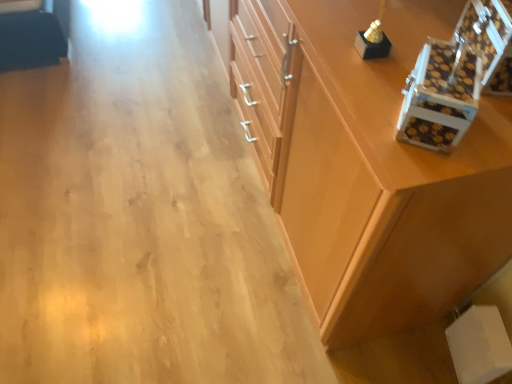
Question: Based on their positions, is white textured box at upper right, the second box in the right-to-left sequence, located to the left or right of brown checkered box at upper right, which appears as the first box when viewed from the right?

Choices:
 (A) left
 (B) right

Answer: (A)

Question: Is white textured box at upper right, marked as the 1th box in a left-to-right arrangement, situated inside brown checkered box at upper right, which is the second box from left to right, or outside?

Choices:
 (A) outside
 (B) inside

Answer: (A)

Question: Estimate the real-world distances between objects in this image. Which object is closer to the wooden cabinet at center?

Choices:
 (A) brown checkered box at upper right, which appears as the first box when viewed from the right
 (B) white textured box at upper right, marked as the 1th box in a left-to-right arrangement

Answer: (B)

Question: Considering the real-world distances, which object is farthest from the brown checkered box at upper right, which is the second box from left to right?

Choices:
 (A) wooden cabinet at center
 (B) white textured box at upper right, the second box in the right-to-left sequence

Answer: (A)